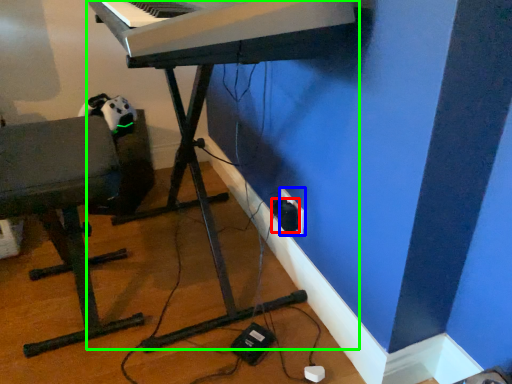
Question: Which is farther away from plug (highlighted by a red box)? electric outlet (highlighted by a blue box) or piano (highlighted by a green box)?

Choices:
 (A) electric outlet
 (B) piano

Answer: (B)